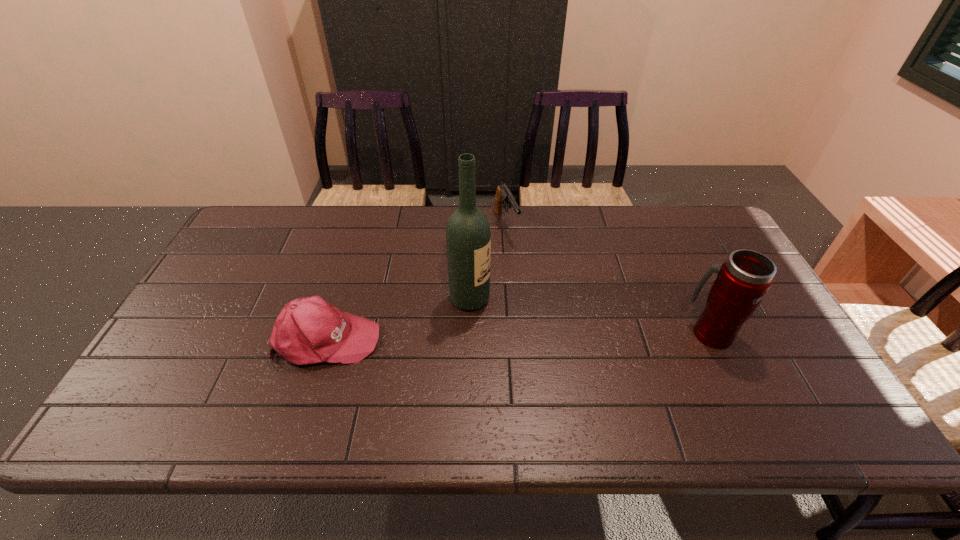
Find the location of a particular element. The image size is (960, 540). vacant space that is in between the gun and the rightmost object is located at coordinates pyautogui.click(x=608, y=279).

Locate an element on the screen. free space between the third object from left to right and the baseball cap is located at coordinates [x=416, y=281].

At what (x,y) coordinates should I click in order to perform the action: click on vacant space that's between the baseball cap and the rightmost object. Please return your answer as a coordinate pair (x, y). The height and width of the screenshot is (540, 960). Looking at the image, I should click on (518, 336).

Find the location of a particular element. The height and width of the screenshot is (540, 960). free spot between the second object from left to right and the rightmost object is located at coordinates (589, 316).

The height and width of the screenshot is (540, 960). Find the location of `free space that is in between the thermos bottle and the baseball cap`. free space that is in between the thermos bottle and the baseball cap is located at coordinates (518, 336).

The image size is (960, 540). What are the coordinates of `object that is the closest to the farthest object` in the screenshot? It's located at (468, 237).

The image size is (960, 540). Identify the location of object that is the third nearest to the third object from left to right. (744, 278).

Locate an element on the screen. The height and width of the screenshot is (540, 960). free space that satisfies the following two spatial constraints: 1. on the back side of the third object from right to left; 2. on the left side of the farthest object is located at coordinates (471, 224).

This screenshot has width=960, height=540. What are the coordinates of `free space that satisfies the following two spatial constraints: 1. on the back side of the gun; 2. on the right side of the wine bottle` in the screenshot? It's located at (471, 224).

I want to click on vacant point that satisfies the following two spatial constraints: 1. on the back side of the farthest object; 2. on the left side of the second object from left to right, so coord(471,224).